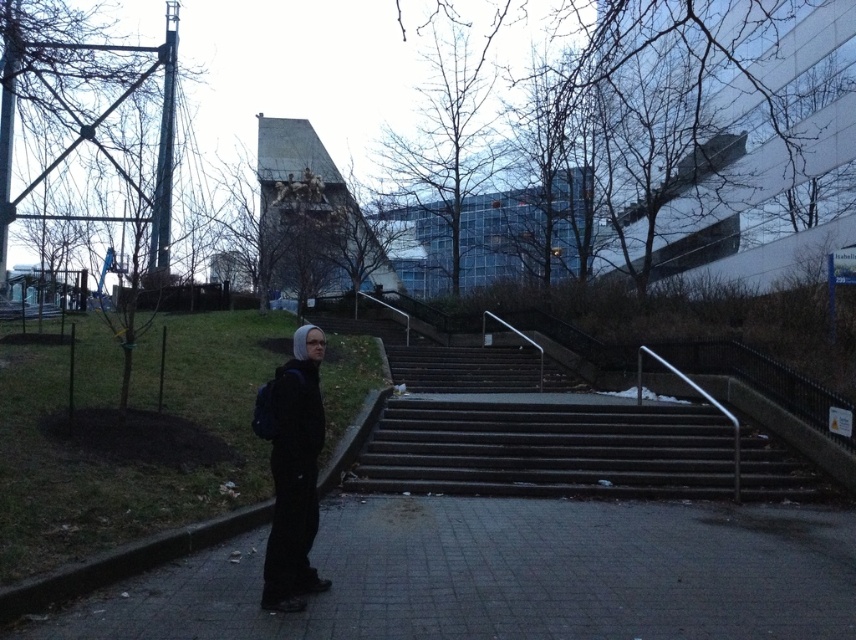
Looking at this image, does dark gray concrete pavement at lower center appear on the left side of black matte clothing at center?

Incorrect, dark gray concrete pavement at lower center is not on the left side of black matte clothing at center.

Is the position of dark gray concrete pavement at lower center less distant than that of black matte clothing at center?

That is True.

Identify the location of dark gray concrete pavement at lower center. The height and width of the screenshot is (640, 856). (509, 577).

You are a GUI agent. You are given a task and a screenshot of the screen. Output one action in this format:
    pyautogui.click(x=<x>, y=<y>)
    Task: Click on the dark gray concrete pavement at lower center
    The height and width of the screenshot is (640, 856).
    Given the screenshot: What is the action you would take?
    pyautogui.click(x=509, y=577)

Can you confirm if dark gray concrete stairs at center is positioned below black matte clothing at center?

Yes.

Who is more distant from viewer, (391, 440) or (289, 412)?

Positioned behind is point (391, 440).

In order to click on dark gray concrete stairs at center in this screenshot , I will do `click(547, 449)`.

Locate an element on the screen. dark gray concrete stairs at center is located at coordinates (547, 449).

Can you confirm if dark gray concrete pavement at lower center is shorter than dark gray concrete stairs at center?

Yes, dark gray concrete pavement at lower center is shorter than dark gray concrete stairs at center.

Is point (734, 612) closer to camera compared to point (597, 448)?

That is True.

At what (x,y) coordinates should I click in order to perform the action: click on dark gray concrete pavement at lower center. Please return your answer as a coordinate pair (x, y). Looking at the image, I should click on (509, 577).